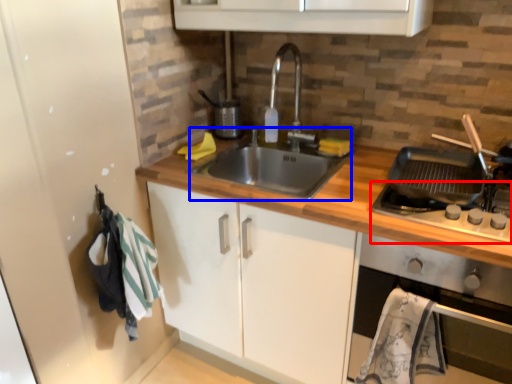
Question: Which of the following is the closest to the observer, gas stove (highlighted by a red box) or sink (highlighted by a blue box)?

Choices:
 (A) gas stove
 (B) sink

Answer: (A)